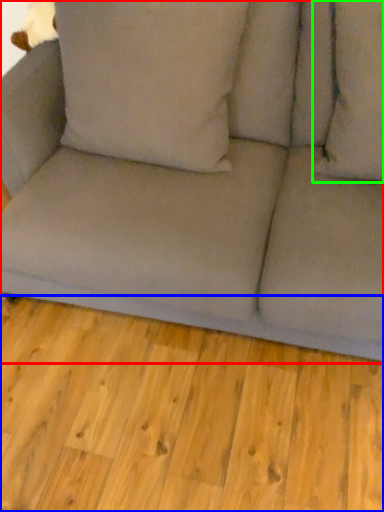
Question: Which object is the closest to the studio couch (highlighted by a red box)? Choose among these: plank (highlighted by a blue box) or pillow (highlighted by a green box).

Choices:
 (A) plank
 (B) pillow

Answer: (B)